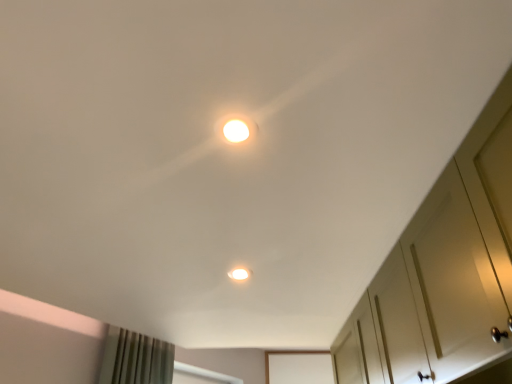
Question: From a real-world perspective, is white glossy light fixture at upper center, the second dot from the back, positioned under matte white light at center, the 2th dot in the front-to-back sequence, based on gravity?

Choices:
 (A) yes
 (B) no

Answer: (A)

Question: Does white glossy light fixture at upper center, positioned as the 2th dot in bottom-to-top order, have a larger size compared to matte white light at center, the second dot viewed from the top?

Choices:
 (A) yes
 (B) no

Answer: (B)

Question: Can you confirm if white glossy light fixture at upper center, positioned as the 2th dot in bottom-to-top order, is smaller than matte white light at center, the second dot viewed from the top?

Choices:
 (A) no
 (B) yes

Answer: (B)

Question: Is white glossy light fixture at upper center, the first dot viewed from the front, not close to matte white light at center, marked as the first dot in a back-to-front arrangement?

Choices:
 (A) yes
 (B) no

Answer: (B)

Question: Is white glossy light fixture at upper center, the first dot viewed from the front, shorter than matte white light at center, marked as the first dot in a back-to-front arrangement?

Choices:
 (A) yes
 (B) no

Answer: (A)

Question: Is white glossy light fixture at upper center, the first dot when ordered from top to bottom, wider or thinner than white matte cabinet at right?

Choices:
 (A) wide
 (B) thin

Answer: (B)

Question: Considering their positions, is white glossy light fixture at upper center, the first dot when ordered from top to bottom, located in front of or behind white matte cabinet at right?

Choices:
 (A) behind
 (B) front

Answer: (A)

Question: Is white glossy light fixture at upper center, the second dot from the back, inside the boundaries of white matte cabinet at right, or outside?

Choices:
 (A) outside
 (B) inside

Answer: (A)

Question: Is white glossy light fixture at upper center, the second dot from the back, bigger or smaller than white matte cabinet at right?

Choices:
 (A) big
 (B) small

Answer: (B)

Question: Is matte white light at center, the 2th dot in the front-to-back sequence, in front of or behind white matte cabinet at right in the image?

Choices:
 (A) front
 (B) behind

Answer: (B)

Question: Considering the relative positions of matte white light at center, marked as the first dot in a back-to-front arrangement, and white matte cabinet at right in the image provided, is matte white light at center, marked as the first dot in a back-to-front arrangement, to the left or to the right of white matte cabinet at right?

Choices:
 (A) right
 (B) left

Answer: (B)

Question: From a real-world perspective, is matte white light at center, the 2th dot in the front-to-back sequence, positioned above or below white matte cabinet at right?

Choices:
 (A) above
 (B) below

Answer: (A)

Question: From the image's perspective, is matte white light at center, the 2th dot in the front-to-back sequence, above or below white matte cabinet at right?

Choices:
 (A) below
 (B) above

Answer: (A)

Question: Does point [x=237, y=125] appear closer or farther from the camera than point [x=231, y=274]?

Choices:
 (A) closer
 (B) farther

Answer: (A)

Question: In terms of height, does white glossy light fixture at upper center, positioned as the 2th dot in bottom-to-top order, look taller or shorter compared to matte white light at center, the second dot viewed from the top?

Choices:
 (A) short
 (B) tall

Answer: (A)